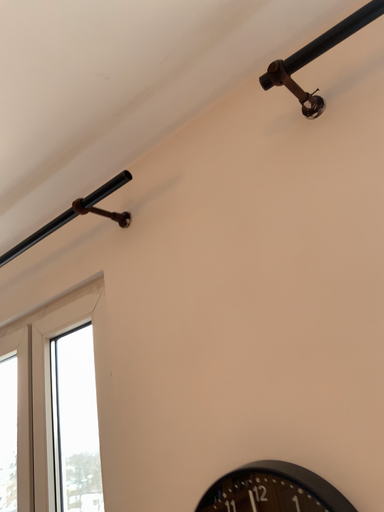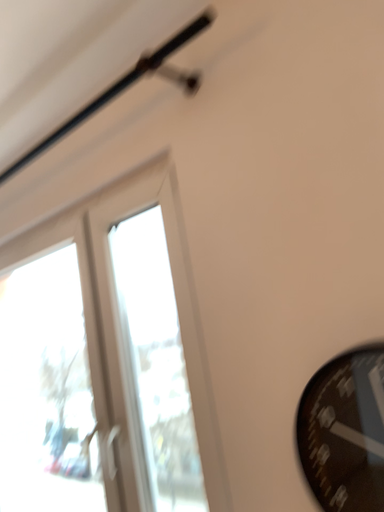
Question: How did the camera likely rotate when shooting the video?

Choices:
 (A) rotated downward
 (B) rotated upward

Answer: (A)